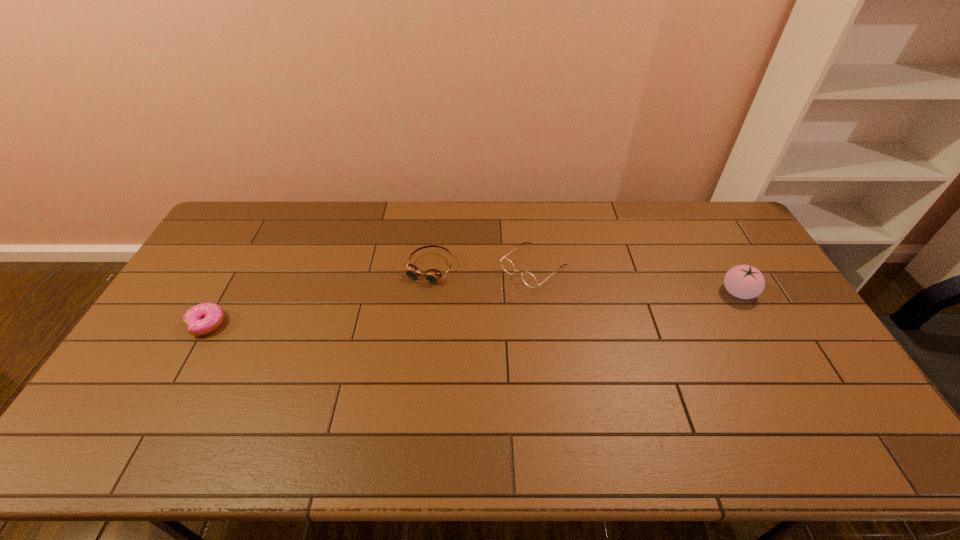
Identify the location of vacant region at the far right corner of the desktop. (704, 202).

Where is `free space that is in between the nearest object and the second object from left to right`? This screenshot has width=960, height=540. free space that is in between the nearest object and the second object from left to right is located at coordinates (319, 295).

Where is `free space between the second object from left to right and the doughnut`? Image resolution: width=960 pixels, height=540 pixels. free space between the second object from left to right and the doughnut is located at coordinates (319, 295).

At what (x,y) coordinates should I click in order to perform the action: click on empty location between the nearest object and the goggles. Please return your answer as a coordinate pair (x, y). This screenshot has height=540, width=960. Looking at the image, I should click on (319, 295).

I want to click on free spot between the rightmost object and the leftmost object, so click(472, 308).

At what (x,y) coordinates should I click in order to perform the action: click on vacant area that lies between the rightmost object and the third object from left to right. Please return your answer as a coordinate pair (x, y). The image size is (960, 540). Looking at the image, I should click on (636, 280).

This screenshot has height=540, width=960. Find the location of `free space between the tallest object and the goggles`. free space between the tallest object and the goggles is located at coordinates (585, 280).

Identify the location of vacant area that lies between the leftmost object and the tomato. (472, 308).

In order to click on free space between the second tallest object and the third object from right to left in this screenshot , I will do `click(482, 267)`.

The height and width of the screenshot is (540, 960). In order to click on empty location between the goggles and the third shortest object in this screenshot , I will do `click(482, 267)`.